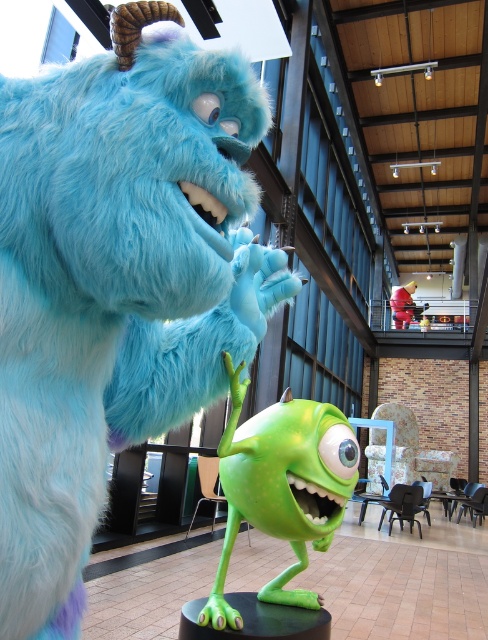
Based on the photo, who is taller, fluffy blue fur at center or rubberized red toy at center?

rubberized red toy at center is taller.

Does point (122, 310) lie behind point (393, 291)?

No, (122, 310) is in front of (393, 291).

Which is in front, point (231, 100) or point (398, 316)?

Point (231, 100) is more forward.

The height and width of the screenshot is (640, 488). Identify the location of fluffy blue fur at center. (117, 282).

Is green rubbery mike at center thinner than rubberized red toy at center?

Yes, green rubbery mike at center is thinner than rubberized red toy at center.

Does green rubbery mike at center have a greater width compared to rubberized red toy at center?

No, green rubbery mike at center is not wider than rubberized red toy at center.

Image resolution: width=488 pixels, height=640 pixels. What are the coordinates of `green rubbery mike at center` in the screenshot? It's located at (282, 486).

Between fluffy blue fur at center and green rubbery mike at center, which one is positioned lower?

green rubbery mike at center

Is fluffy blue fur at center above green rubbery mike at center?

Correct, fluffy blue fur at center is located above green rubbery mike at center.

Does point (145, 305) come farther from viewer compared to point (343, 509)?

No.

This screenshot has height=640, width=488. In order to click on fluffy blue fur at center in this screenshot , I will do `click(117, 282)`.